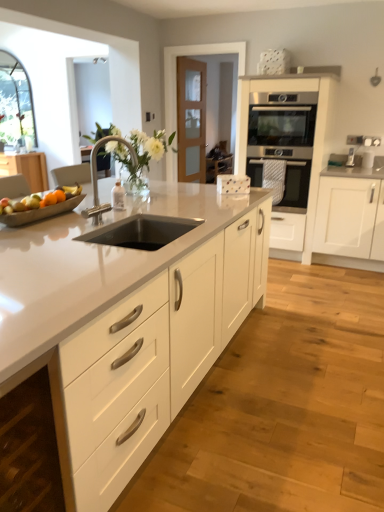
Find the location of `blank space above shiny metallic bowl at left (from a real-world perspective)`. blank space above shiny metallic bowl at left (from a real-world perspective) is located at coordinates (32, 200).